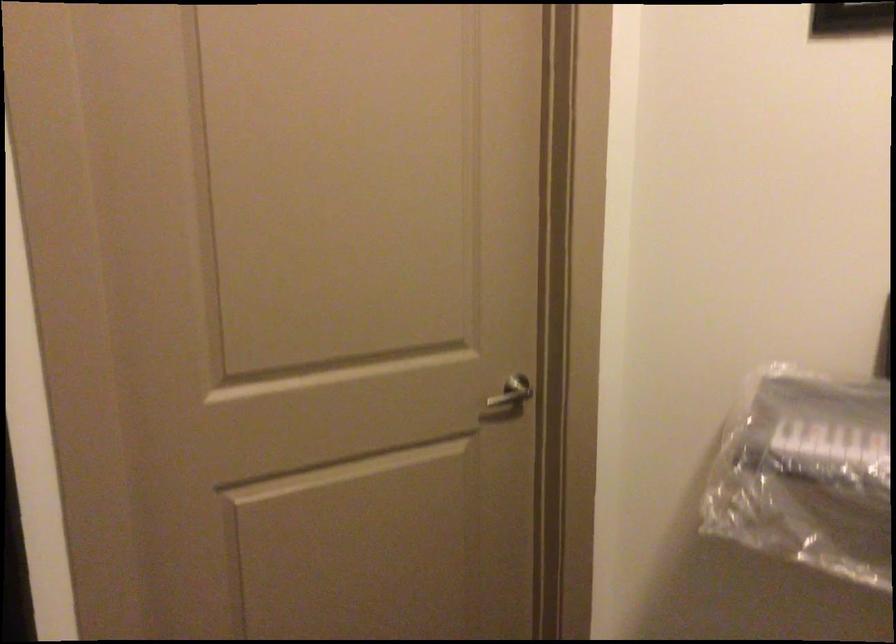
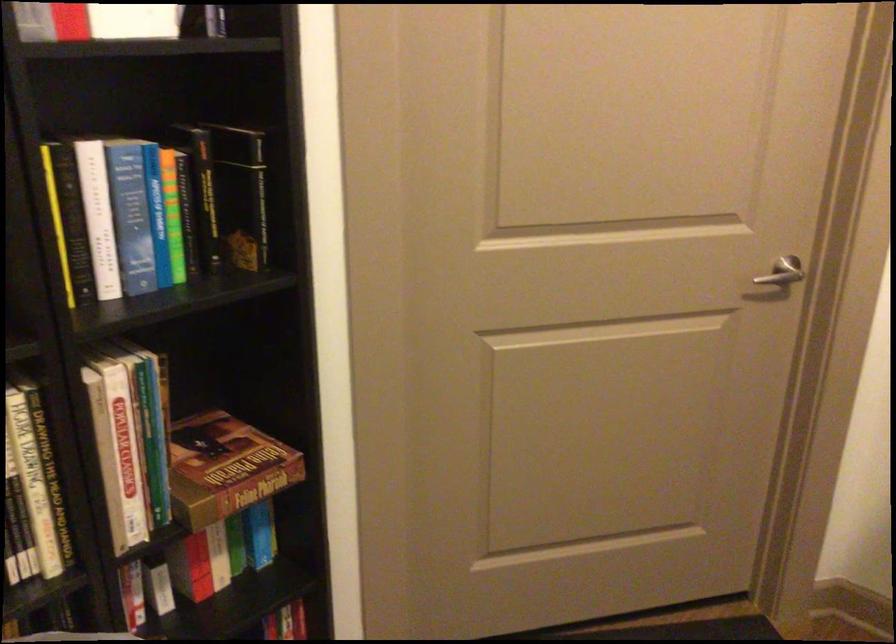
Where in the second image is the point corresponding to point 512,395 from the first image?

(781, 272)